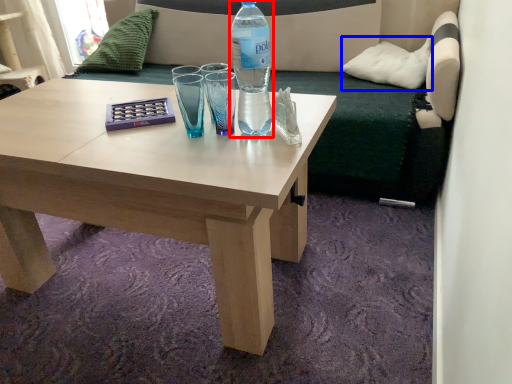
Question: Which point is further to the camera, bottle (highlighted by a red box) or pillow (highlighted by a blue box)?

Choices:
 (A) bottle
 (B) pillow

Answer: (B)